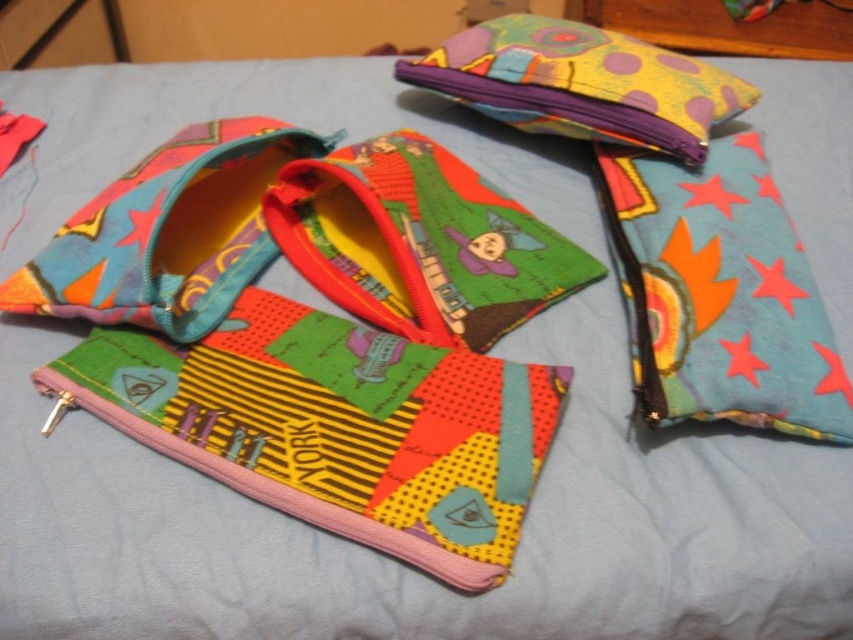
Question: Which point appears farthest from the camera in this image?

Choices:
 (A) (740, 346)
 (B) (543, 51)

Answer: (B)

Question: Which object is farther from the camera taking this photo?

Choices:
 (A) multicolored fabric pouch at upper center
 (B) teal fabric pouch at right

Answer: (A)

Question: Where is teal fabric pouch at right located in relation to multicolored fabric pouch at upper center in the image?

Choices:
 (A) left
 (B) right

Answer: (B)

Question: In this image, where is teal fabric pouch at right located relative to multicolored fabric pouch at upper center?

Choices:
 (A) above
 (B) below

Answer: (B)

Question: From the image, what is the correct spatial relationship of teal fabric pouch at right in relation to multicolored fabric pouch at upper center?

Choices:
 (A) above
 (B) below

Answer: (B)